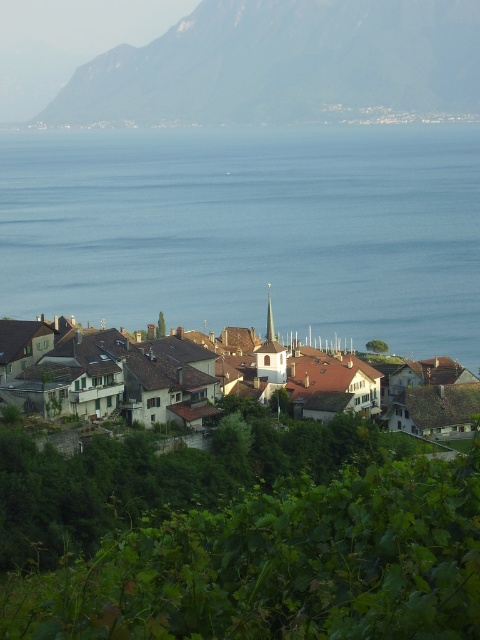
Question: Which of the following is the closest to the observer?

Choices:
 (A) 312,400
 (B) 146,72

Answer: (A)

Question: Is rocky gray mountain at upper center above smooth gray spire at center?

Choices:
 (A) no
 (B) yes

Answer: (B)

Question: Which of the following is the closest to the observer?

Choices:
 (A) rocky gray mountain at upper center
 (B) brown tiled roofs at center
 (C) blue water at center

Answer: (B)

Question: Does blue water at center come behind brown tiled roofs at center?

Choices:
 (A) yes
 (B) no

Answer: (A)

Question: Among these objects, which one is farthest from the camera?

Choices:
 (A) blue water at center
 (B) rocky gray mountain at upper center

Answer: (B)

Question: Does rocky gray mountain at upper center lie in front of smooth gray spire at center?

Choices:
 (A) no
 (B) yes

Answer: (A)